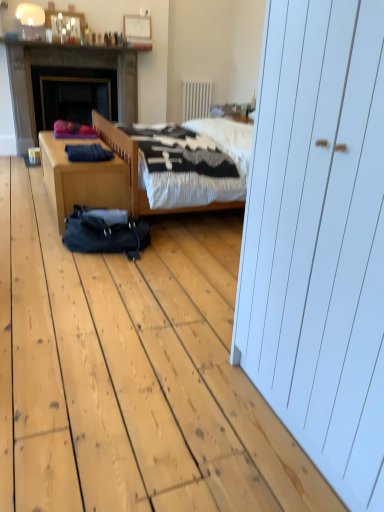
Question: From a real-world perspective, is wooden desk at lower left beneath dark gray stone fireplace at left?

Choices:
 (A) yes
 (B) no

Answer: (A)

Question: Is wooden desk at lower left oriented away from dark gray stone fireplace at left?

Choices:
 (A) yes
 (B) no

Answer: (B)

Question: From the image's perspective, is wooden desk at lower left beneath dark gray stone fireplace at left?

Choices:
 (A) yes
 (B) no

Answer: (A)

Question: Is wooden desk at lower left wider than dark gray stone fireplace at left?

Choices:
 (A) yes
 (B) no

Answer: (A)

Question: From the image's perspective, does wooden desk at lower left appear higher than dark gray stone fireplace at left?

Choices:
 (A) yes
 (B) no

Answer: (B)

Question: Does wooden desk at lower left have a smaller size compared to dark gray stone fireplace at left?

Choices:
 (A) yes
 (B) no

Answer: (A)

Question: Is shiny glass bottles at upper center oriented towards white textured radiator at upper center?

Choices:
 (A) yes
 (B) no

Answer: (B)

Question: Is shiny glass bottles at upper center far from white textured radiator at upper center?

Choices:
 (A) yes
 (B) no

Answer: (A)

Question: Can you confirm if shiny glass bottles at upper center is taller than white textured radiator at upper center?

Choices:
 (A) no
 (B) yes

Answer: (A)

Question: Does shiny glass bottles at upper center appear on the left side of white textured radiator at upper center?

Choices:
 (A) yes
 (B) no

Answer: (A)

Question: Is shiny glass bottles at upper center looking in the opposite direction of white textured radiator at upper center?

Choices:
 (A) yes
 (B) no

Answer: (B)

Question: Is shiny glass bottles at upper center in contact with white textured radiator at upper center?

Choices:
 (A) yes
 (B) no

Answer: (B)

Question: From the image's perspective, does white textured radiator at upper center appear lower than dark gray stone fireplace at left?

Choices:
 (A) yes
 (B) no

Answer: (B)